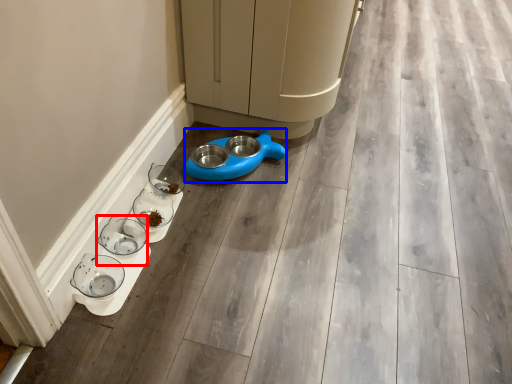
Question: Which object appears farthest to the camera in this image, glass bowl (highlighted by a red box) or appliance (highlighted by a blue box)?

Choices:
 (A) glass bowl
 (B) appliance

Answer: (B)